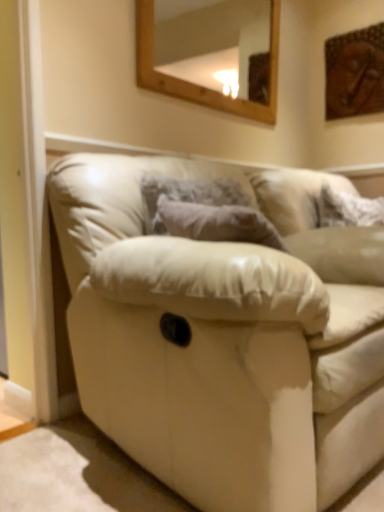
Question: From a real-world perspective, is white fluffy pillow at upper right above or below leather couch at center?

Choices:
 (A) below
 (B) above

Answer: (B)

Question: In the image, is white fluffy pillow at upper right on the left side or the right side of leather couch at center?

Choices:
 (A) left
 (B) right

Answer: (B)

Question: Which is nearer to the leather couch at center?

Choices:
 (A) wooden-framed mirror at upper center
 (B) white fluffy pillow at upper right
 (C) wooden carving at upper right

Answer: (B)

Question: Which object is the farthest from the leather couch at center?

Choices:
 (A) wooden carving at upper right
 (B) white fluffy pillow at upper right
 (C) wooden-framed mirror at upper center

Answer: (C)